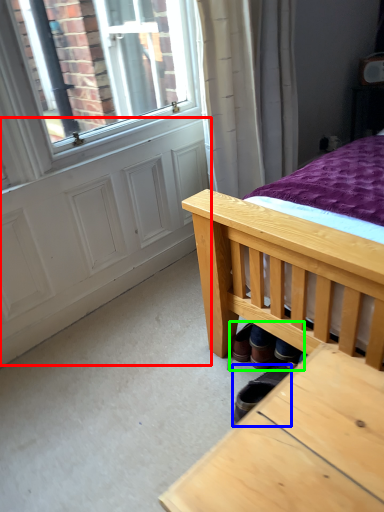
Question: Considering the real-world distances, which object is closest to screen door (highlighted by a red box)? footwear (highlighted by a blue box) or shoe (highlighted by a green box).

Choices:
 (A) footwear
 (B) shoe

Answer: (B)